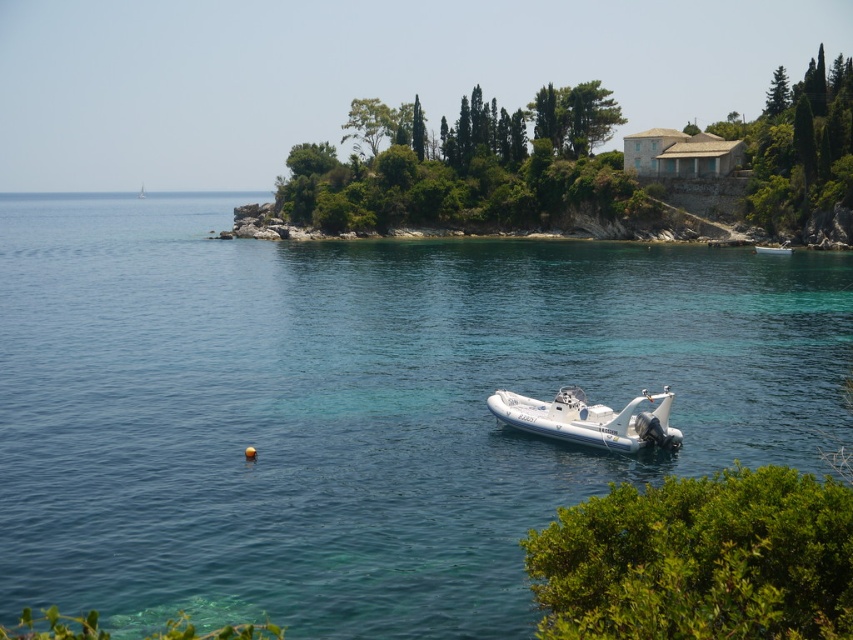
You are standing on the shore and see the clear blue water at center and the white rubber boat at center. Which object is closer to your left side?

The clear blue water at center is closer to your left side because it is positioned to the left of the white rubber boat at center.

You are a photographer planning to capture the white rubber boat at center in your shot. The clear blue water at center is directly in front of the boat. Will the water block the boat from being fully visible in your photo?

The clear blue water at center is above the white rubber boat at center, so the water is positioned over the boat, which might not block its visibility since it is transparent. However, depending on the clarity of the water, parts of the boat could be obscured.